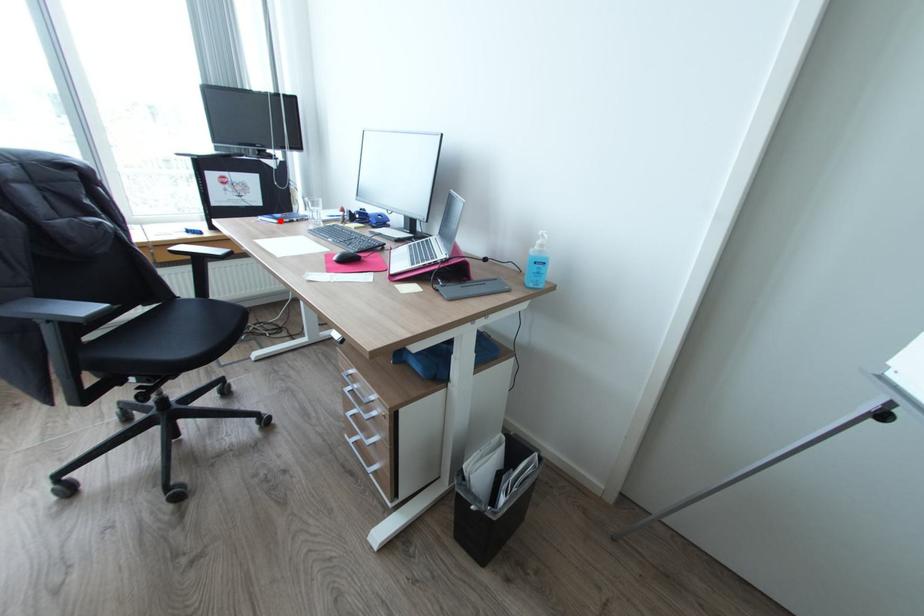
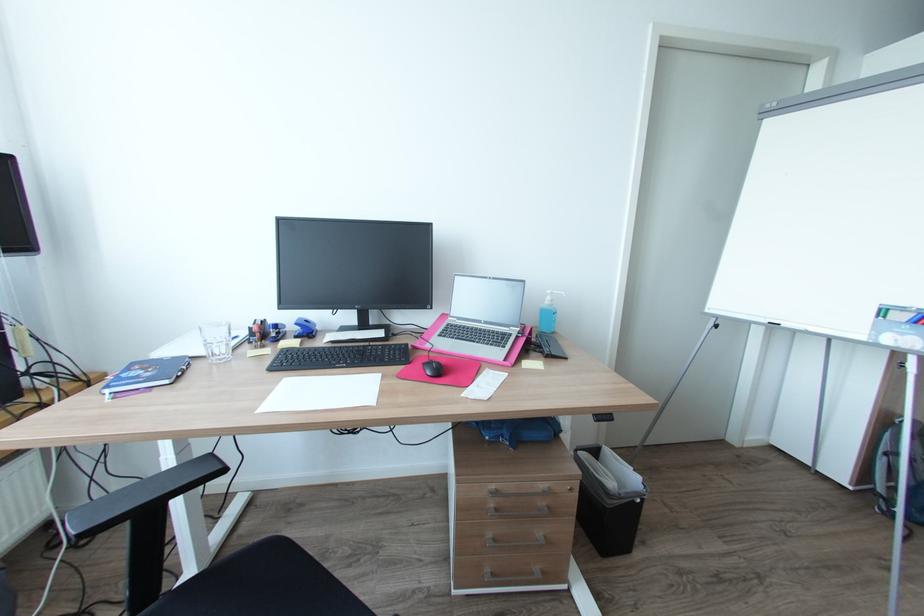
Locate, in the second image, the point that corresponds to the highlighted location in the first image.

(171, 381)